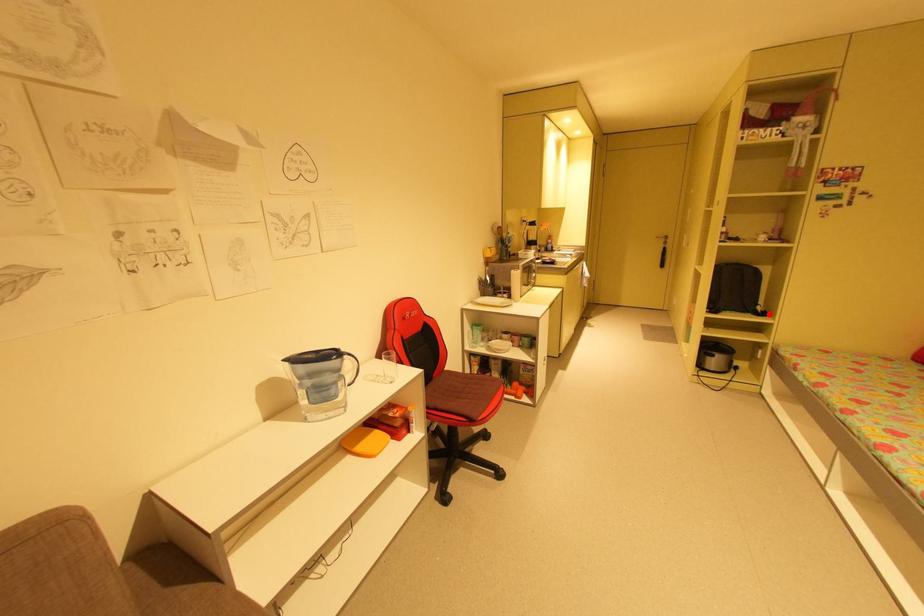
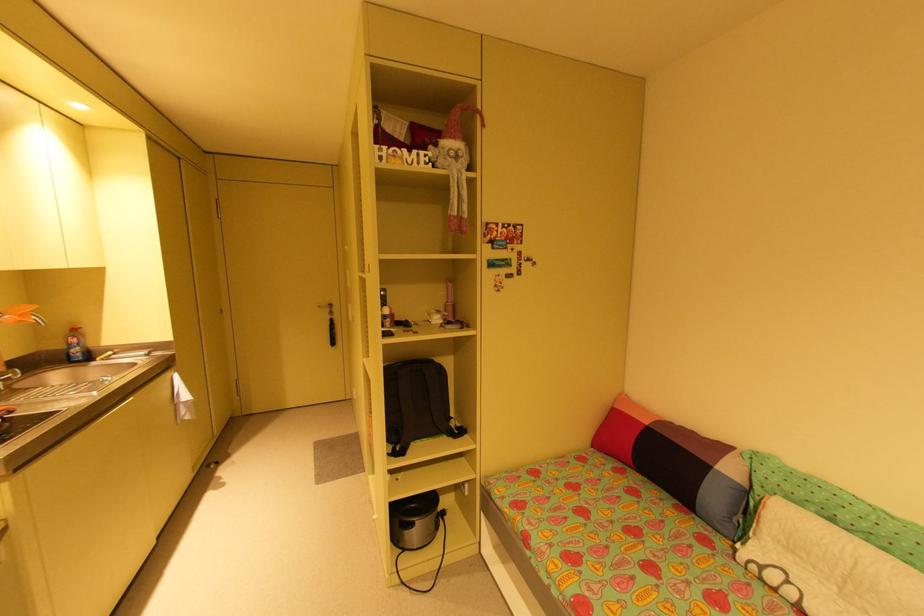
Find the pixel in the second image that matches the highlighted location in the first image.

(466, 431)